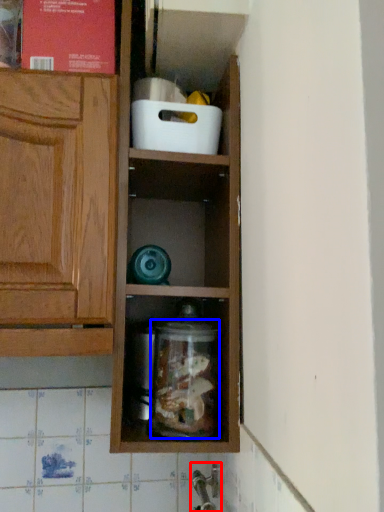
Question: Among these objects, which one is nearest to the camera, faucet (highlighted by a red box) or glass jar (highlighted by a blue box)?

Choices:
 (A) faucet
 (B) glass jar

Answer: (B)